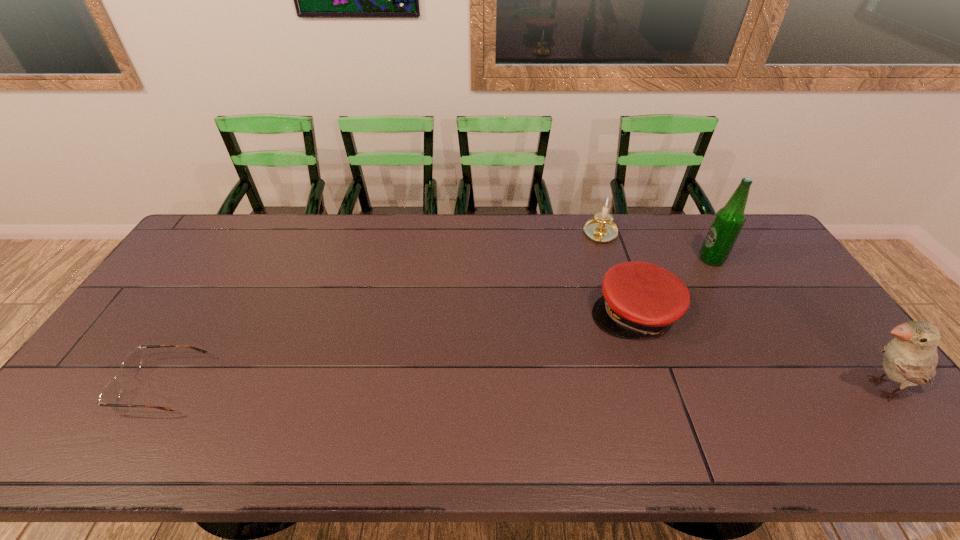
Where is `empty location between the shortest object and the beer bottle`? empty location between the shortest object and the beer bottle is located at coordinates (436, 322).

This screenshot has width=960, height=540. I want to click on vacant area that lies between the second farthest object and the bird, so click(796, 324).

Locate an element on the screen. vacant area that lies between the third farthest object and the shortest object is located at coordinates (397, 350).

Identify which object is located as the fourth nearest to the spectacles. Please provide its 2D coordinates. Your answer should be formatted as a tuple, i.e. [(x, y)], where the tuple contains the x and y coordinates of a point satisfying the conditions above.

[(910, 359)]

Locate an element on the screen. This screenshot has width=960, height=540. object that is the fourth closest to the farthest object is located at coordinates (110, 394).